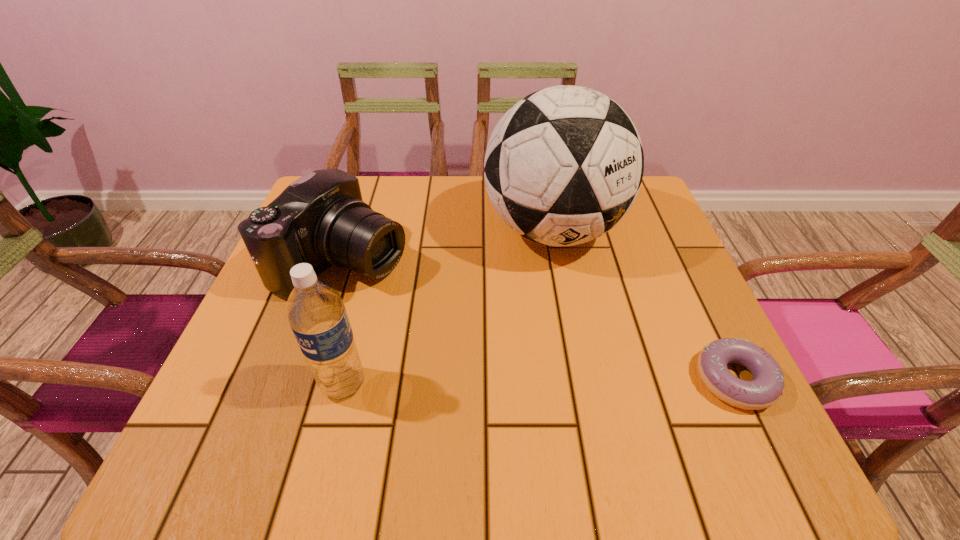
The image size is (960, 540). I want to click on soccer ball that is positioned at the right edge, so click(x=564, y=165).

The width and height of the screenshot is (960, 540). In order to click on object located at the far left corner in this screenshot , I will do `click(321, 219)`.

Image resolution: width=960 pixels, height=540 pixels. In order to click on object located in the far right corner section of the desktop in this screenshot , I will do `click(564, 165)`.

This screenshot has width=960, height=540. I want to click on object that is at the near right corner, so click(x=766, y=388).

Find the location of a particular element. This screenshot has width=960, height=540. free space at the far edge is located at coordinates (377, 206).

Find the location of a particular element. The image size is (960, 540). free space at the near edge of the desktop is located at coordinates (565, 394).

In the image, there is a desktop. Where is `blank space at the left edge`? The height and width of the screenshot is (540, 960). blank space at the left edge is located at coordinates 264,300.

Image resolution: width=960 pixels, height=540 pixels. Identify the location of vacant region at the right edge of the desktop. (634, 238).

What are the coordinates of `vacant space at the near left corner of the desktop` in the screenshot? It's located at (226, 374).

Where is `vacant area between the soccer ball and the water bottle`? The image size is (960, 540). vacant area between the soccer ball and the water bottle is located at coordinates (448, 307).